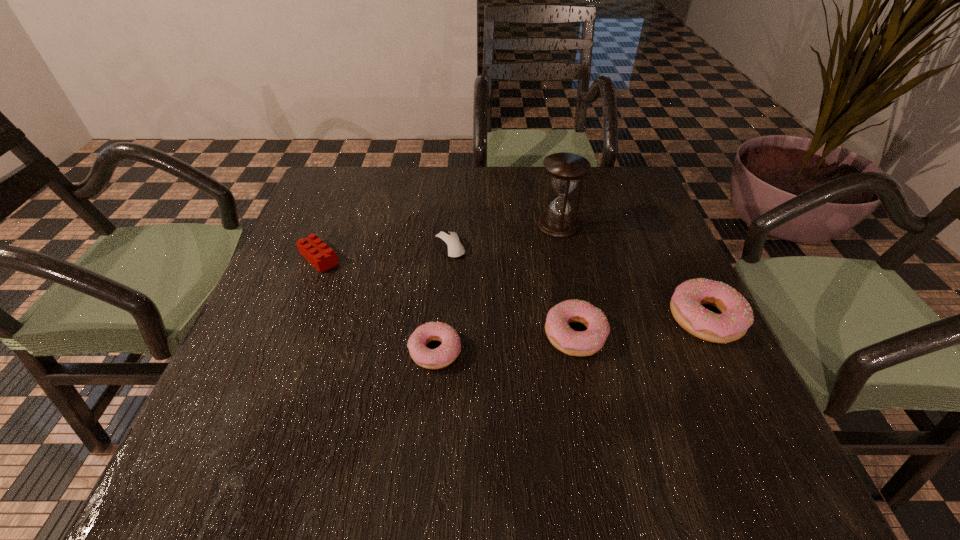
You are a GUI agent. You are given a task and a screenshot of the screen. Output one action in this format:
    pyautogui.click(x=<x>, y=<y>)
    Task: Click on the vacant space located on the left of the second tallest object
    The height and width of the screenshot is (540, 960).
    Given the screenshot: What is the action you would take?
    pyautogui.click(x=518, y=318)

The width and height of the screenshot is (960, 540). In order to click on vacant area located on the back of the tallest object in this screenshot , I will do `click(553, 201)`.

Locate an element on the screen. This screenshot has height=540, width=960. vacant region located 0.170m on the right of the mouse is located at coordinates (537, 247).

This screenshot has width=960, height=540. I want to click on free space located on the back of the Lego, so click(335, 217).

Where is `object at the far edge`? object at the far edge is located at coordinates (565, 169).

You are a GUI agent. You are given a task and a screenshot of the screen. Output one action in this format:
    pyautogui.click(x=<x>, y=<y>)
    Task: Click on the object that is at the left edge
    Image resolution: width=960 pixels, height=540 pixels.
    Given the screenshot: What is the action you would take?
    pyautogui.click(x=312, y=248)

Where is `object that is at the right edge`? The width and height of the screenshot is (960, 540). object that is at the right edge is located at coordinates (686, 304).

This screenshot has height=540, width=960. What are the coordinates of `vacant point at the far edge` in the screenshot? It's located at coord(423,169).

Identify the location of vacant space at the near edge of the desktop. (392, 385).

Identify the location of free location at the left edge of the desktop. This screenshot has height=540, width=960. pos(294,313).